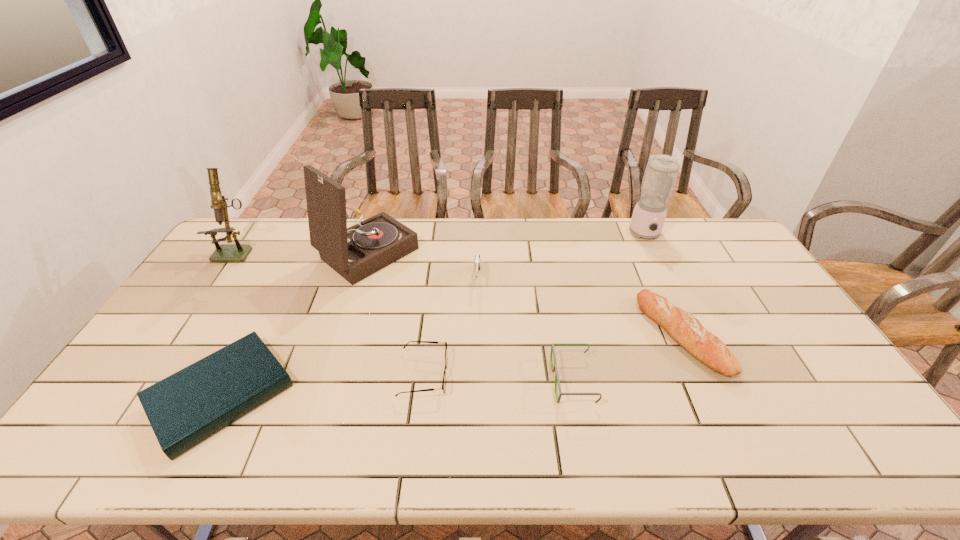
Where is `vacant area that lies between the sixth object from left to right and the food processor`? vacant area that lies between the sixth object from left to right and the food processor is located at coordinates (610, 307).

At what (x,y) coordinates should I click in order to perform the action: click on the closest object relative to the right spectacles. Please return your answer as a coordinate pair (x, y). The width and height of the screenshot is (960, 540). Looking at the image, I should click on (681, 326).

Identify which object is the fourth closest to the book. Please provide its 2D coordinates. Your answer should be formatted as a tuple, i.e. [(x, y)], where the tuple contains the x and y coordinates of a point satisfying the conditions above.

[(477, 260)]

Where is `free space that satisfies the following two spatial constraints: 1. on the back side of the fourth shortest object; 2. on the right side of the book`? This screenshot has width=960, height=540. free space that satisfies the following two spatial constraints: 1. on the back side of the fourth shortest object; 2. on the right side of the book is located at coordinates (252, 335).

Where is `vacant position in the image that satisfies the following two spatial constraints: 1. on the front side of the fifth tallest object; 2. on the lens of the right spectacles`? This screenshot has height=540, width=960. vacant position in the image that satisfies the following two spatial constraints: 1. on the front side of the fifth tallest object; 2. on the lens of the right spectacles is located at coordinates (703, 380).

The height and width of the screenshot is (540, 960). I want to click on vacant space that satisfies the following two spatial constraints: 1. at the muzzle of the baguet; 2. on the right side of the fifth shortest object, so click(x=477, y=335).

Where is `free space that satisfies the following two spatial constraints: 1. at the eyepiece of the microscope; 2. on the left side of the book`? free space that satisfies the following two spatial constraints: 1. at the eyepiece of the microscope; 2. on the left side of the book is located at coordinates (141, 395).